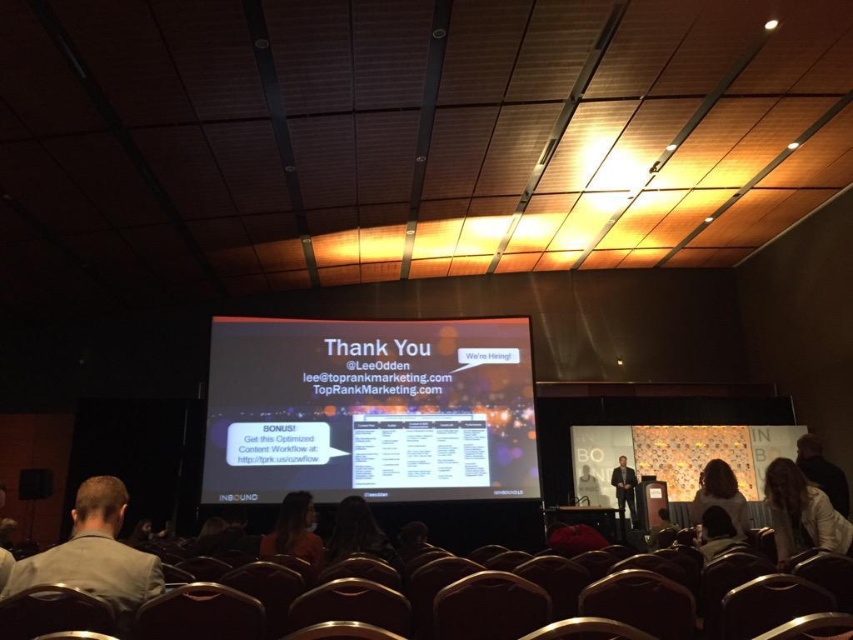
You are an attendee at the seminar and you want to borrow a jacket from the stage. You see a white fabric jacket at lower right and an orange fabric chair at lower center. Which object is located to the right of the other?

The white fabric jacket at lower right is positioned on the right side of orange fabric chair at lower center.

In the scene shown: You are a photographer positioned at the front of the auditorium. You want to take a closeup shot of the white fabric jacket at lower right without moving your camera. Can you estimate if the jacket is within the minimum focusing distance of your camera, which is 2.5 meters?

The white fabric jacket at lower right is 2.60 meters away from the camera. Since the minimum focusing distance is 2.5 meters, the jacket is slightly beyond the minimum distance, so the camera should be able to focus on it.

You are an event organizer who needs to arrange a photo shoot for the stage setup. The photographer mentioned that the matte black hair at center and the dark brown leather chair at lower right must be in the frame. Considering their sizes, which object should be placed closer to the camera to ensure both fit well in the photo?

The matte black hair at center has a lesser width compared to the dark brown leather chair at lower right. To ensure both fit well in the photo, the dark brown leather chair at lower right should be placed closer to the camera since it is wider and requires more space in the frame.